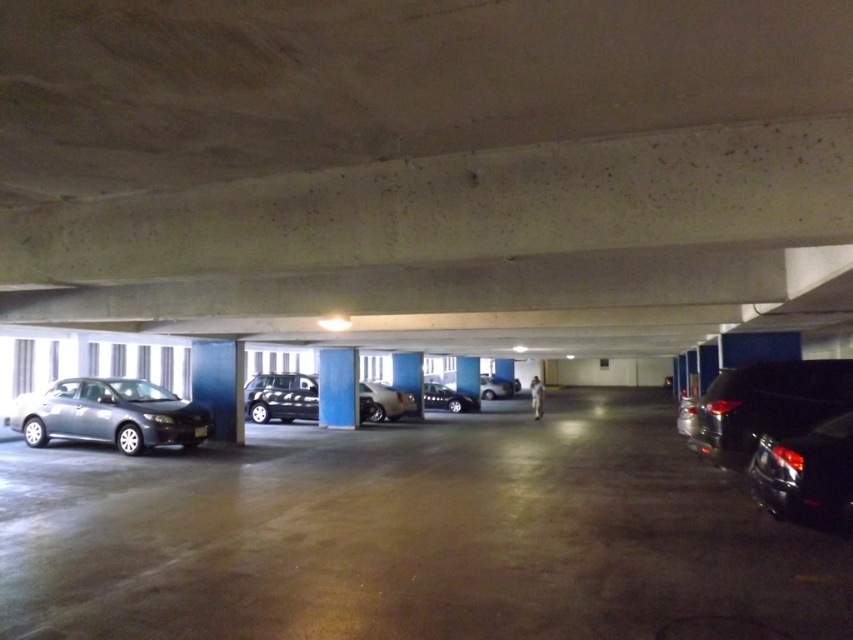
You are a delivery robot with a length of 2.2 meters. You need to move from the entrance to the exit of the parking garage, which is directly across from the entrance. There are two cars parked in your path, the metallic gray car at left and the black matte car at right. Can you navigate between them without needing to move either car?

The metallic gray car at left and the black matte car at right are 4.45 meters apart. Since the delivery robot is 2.2 meters long, it can fit between them as the distance between the cars is double the robot length, so yes, the robot can navigate between them.

You are standing in the parking garage and want to take a photo of both the metallic gray car at left and the black matte car at right. Which car should you focus on first to ensure both are in sharp focus?

You should focus on the metallic gray car at left first because it is closer to you than the black matte car at right, so adjusting focus from near to far will help both be in sharp focus.

You are a delivery person trying to park your van, which is 1.8 meters tall, in this parking garage. The black glossy car at right and the silver metallic sedan at center are already parked. Which car should you avoid parking next to if your van is taller than both?

The black glossy car at right has a greater height compared to the silver metallic sedan at center. Since your van is taller than both, you should avoid parking next to the black glossy car at right as it is the taller vehicle.